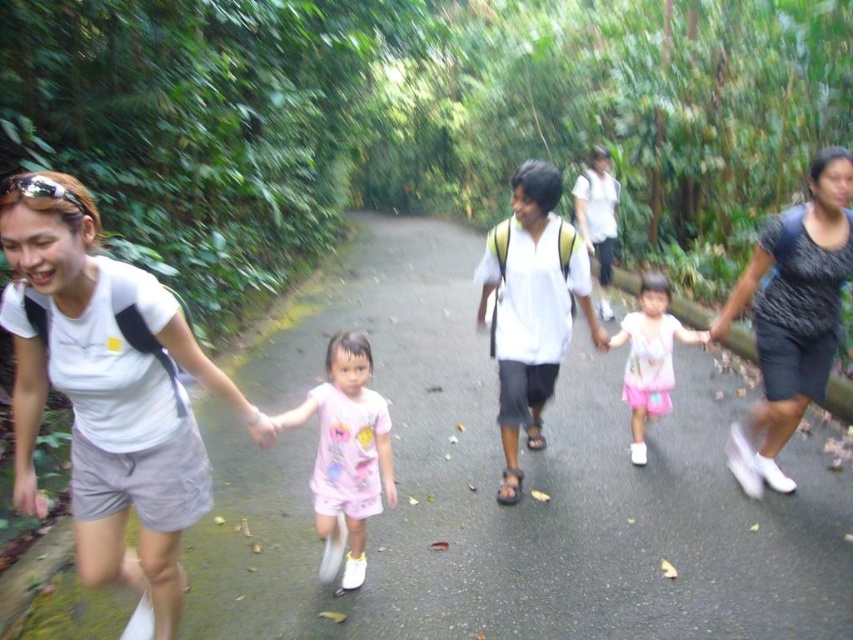
Can you confirm if white matte t-shirt at left is positioned above dark gray dress at right?

No.

Does point (68, 196) come behind point (811, 337)?

No, (68, 196) is closer to viewer.

Locate an element on the screen. The image size is (853, 640). white matte t-shirt at left is located at coordinates (107, 396).

Which of these two, asphalt road at center or pink fabric dress at center, stands shorter?

With less height is pink fabric dress at center.

Is asphalt road at center above pink fabric dress at center?

No.

I want to click on asphalt road at center, so click(x=494, y=490).

Locate an element on the screen. This screenshot has width=853, height=640. asphalt road at center is located at coordinates (494, 490).

Is pink cotton dress at center below pink fabric dress at center?

Yes.

Is pink cotton dress at center to the left of pink fabric dress at center from the viewer's perspective?

Correct, you'll find pink cotton dress at center to the left of pink fabric dress at center.

Where is `pink cotton dress at center`? pink cotton dress at center is located at coordinates (346, 456).

Identify the location of pink cotton dress at center. The width and height of the screenshot is (853, 640). (346, 456).